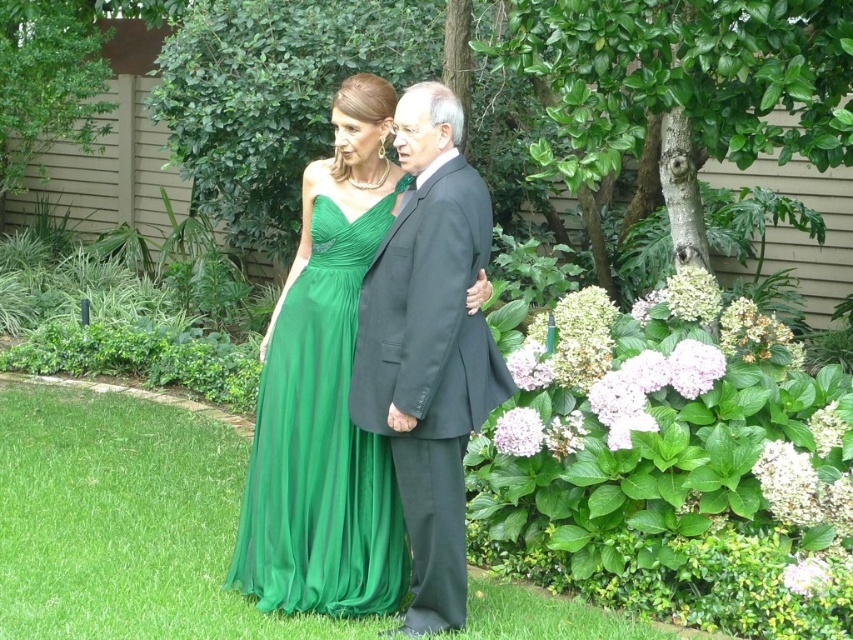
Does matte black suit at center appear on the left side of emerald green chiffon dress at center?

Incorrect, matte black suit at center is not on the left side of emerald green chiffon dress at center.

Is matte black suit at center closer to the viewer compared to emerald green chiffon dress at center?

Yes.

Between point (496, 390) and point (321, 387), which one is positioned behind?

The point (321, 387) is more distant.

Identify the location of matte black suit at center. Image resolution: width=853 pixels, height=640 pixels. (428, 348).